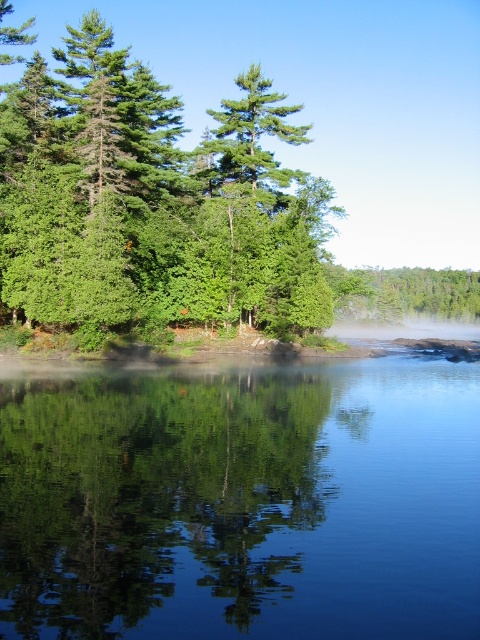
This screenshot has width=480, height=640. What do you see at coordinates (242, 502) in the screenshot?
I see `transparent glass water at center` at bounding box center [242, 502].

Which of these two, transparent glass water at center or green leafy trees at upper left, stands taller?

Standing taller between the two is green leafy trees at upper left.

Locate an element on the screen. transparent glass water at center is located at coordinates click(x=242, y=502).

Where is `transparent glass water at center`? transparent glass water at center is located at coordinates (242, 502).